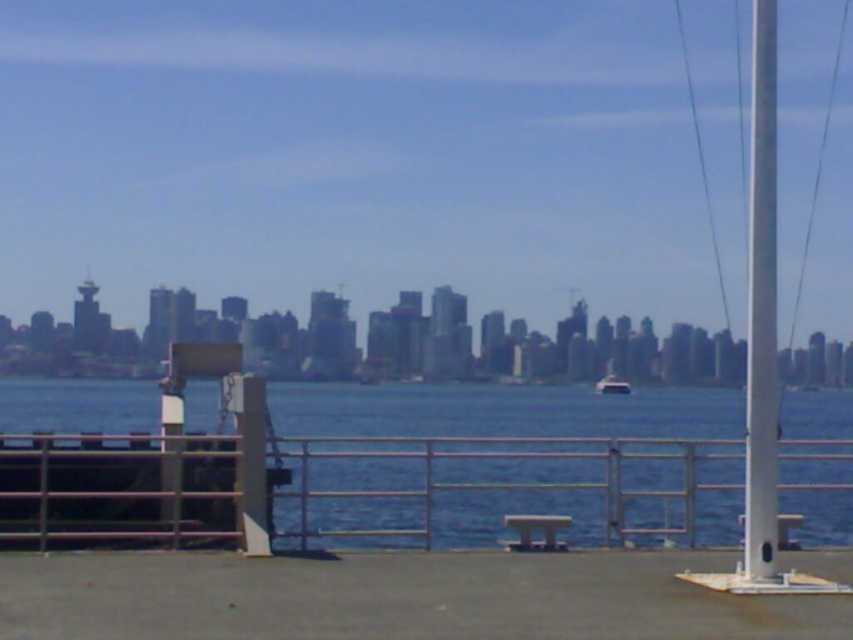
Can you confirm if blue water at center is wider than smooth concrete dock at lower center?

Indeed, blue water at center has a greater width compared to smooth concrete dock at lower center.

The height and width of the screenshot is (640, 853). What do you see at coordinates (541, 433) in the screenshot?
I see `blue water at center` at bounding box center [541, 433].

Find the location of a particular element. The height and width of the screenshot is (640, 853). blue water at center is located at coordinates (541, 433).

Between smooth concrete dock at lower center and smooth silver pole at right, which one is positioned higher?

smooth silver pole at right is higher up.

Can you confirm if smooth concrete dock at lower center is shorter than smooth silver pole at right?

Correct, smooth concrete dock at lower center is not as tall as smooth silver pole at right.

Is point (283, 609) positioned before point (759, 131)?

Yes, it is.

Identify the location of smooth concrete dock at lower center. (395, 596).

Does smooth concrete dock at lower center have a larger size compared to white plastic boat at center?

No.

Is smooth concrete dock at lower center positioned at the back of white plastic boat at center?

No, it is in front of white plastic boat at center.

Is point (671, 634) farther from camera compared to point (596, 384)?

No, (671, 634) is closer to viewer.

Where is `smooth concrete dock at lower center`? This screenshot has width=853, height=640. smooth concrete dock at lower center is located at coordinates [x=395, y=596].